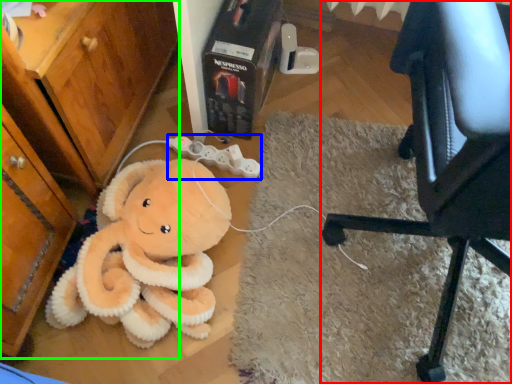
Question: Based on their relative distances, which object is farther from chair (highlighted by a red box)? Choose from game controller (highlighted by a blue box) and dresser (highlighted by a green box).

Choices:
 (A) game controller
 (B) dresser

Answer: (B)